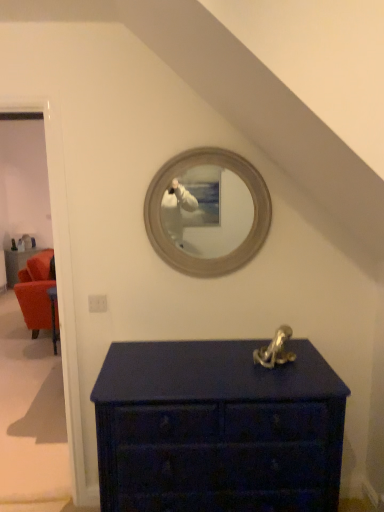
Question: Should I look upward or downward to see velvet orange armchair at left?

Choices:
 (A) down
 (B) up

Answer: (A)

Question: Would you say matte dark blue chest of drawers at lower center is part of matte white door at left's contents?

Choices:
 (A) yes
 (B) no

Answer: (B)

Question: Does matte white door at left have a larger size compared to matte dark blue chest of drawers at lower center?

Choices:
 (A) yes
 (B) no

Answer: (B)

Question: Would you say matte white door at left is outside matte dark blue chest of drawers at lower center?

Choices:
 (A) yes
 (B) no

Answer: (A)

Question: From a real-world perspective, is matte white door at left located beneath matte dark blue chest of drawers at lower center?

Choices:
 (A) yes
 (B) no

Answer: (B)

Question: Is matte white door at left smaller than matte dark blue chest of drawers at lower center?

Choices:
 (A) yes
 (B) no

Answer: (A)

Question: From a real-world perspective, is matte white door at left physically above matte dark blue chest of drawers at lower center?

Choices:
 (A) no
 (B) yes

Answer: (B)

Question: Is matte dark blue chest of drawers at lower center turned away from matte white door at left?

Choices:
 (A) no
 (B) yes

Answer: (A)

Question: From the image's perspective, is matte dark blue chest of drawers at lower center beneath matte white door at left?

Choices:
 (A) no
 (B) yes

Answer: (B)

Question: From a real-world perspective, is matte dark blue chest of drawers at lower center on top of matte white door at left?

Choices:
 (A) yes
 (B) no

Answer: (B)

Question: Does matte dark blue chest of drawers at lower center have a smaller size compared to matte white door at left?

Choices:
 (A) yes
 (B) no

Answer: (B)

Question: Can you confirm if matte dark blue chest of drawers at lower center is shorter than matte white door at left?

Choices:
 (A) no
 (B) yes

Answer: (B)

Question: Does matte dark blue chest of drawers at lower center have a larger size compared to matte white door at left?

Choices:
 (A) yes
 (B) no

Answer: (A)

Question: Does matte white door at left have a larger size compared to velvet orange armchair at left?

Choices:
 (A) yes
 (B) no

Answer: (B)